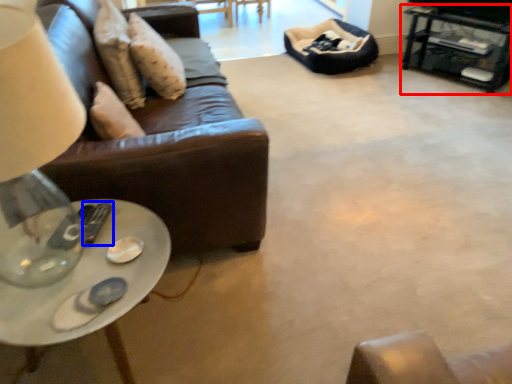
Question: Which point is further to the camera, table (highlighted by a red box) or remote (highlighted by a blue box)?

Choices:
 (A) table
 (B) remote

Answer: (A)